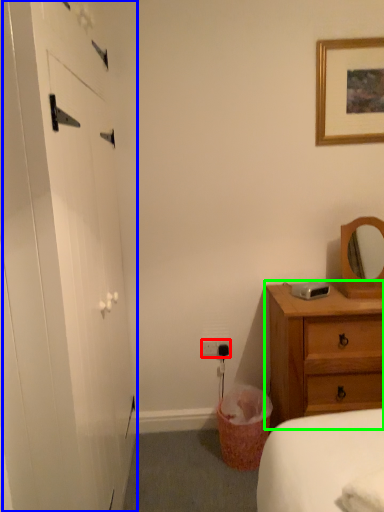
Question: Which object is the closest to the electric outlet (highlighted by a red box)? Choose among these: barn door (highlighted by a blue box) or chest of drawers (highlighted by a green box).

Choices:
 (A) barn door
 (B) chest of drawers

Answer: (B)